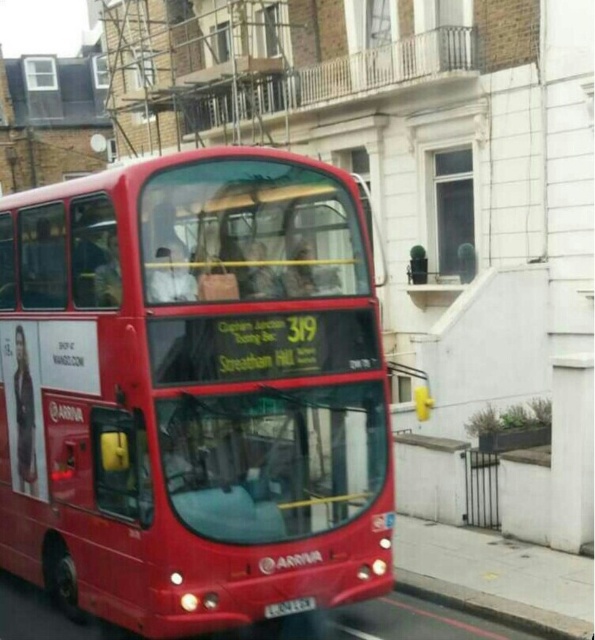
You are a passenger on the classic red double decker bus marked 319 heading towards Streatham Hill. You notice two points marked on the bus. From your perspective inside the bus, which point would be closer to you, point (48, 593) or point (447, 596)?

Point (447, 596) is closer to you because it is in front of point 0.928, 0.083 according to the description.

You are a delivery person trying to park your van near the gray concrete curb at lower right and the black plastic license plate at center. Which object is larger in size so you can use it as a reference for parking?

The gray concrete curb at lower right is bigger than the black plastic license plate at center, so you can use the gray concrete curb at lower right as a reference for parking.